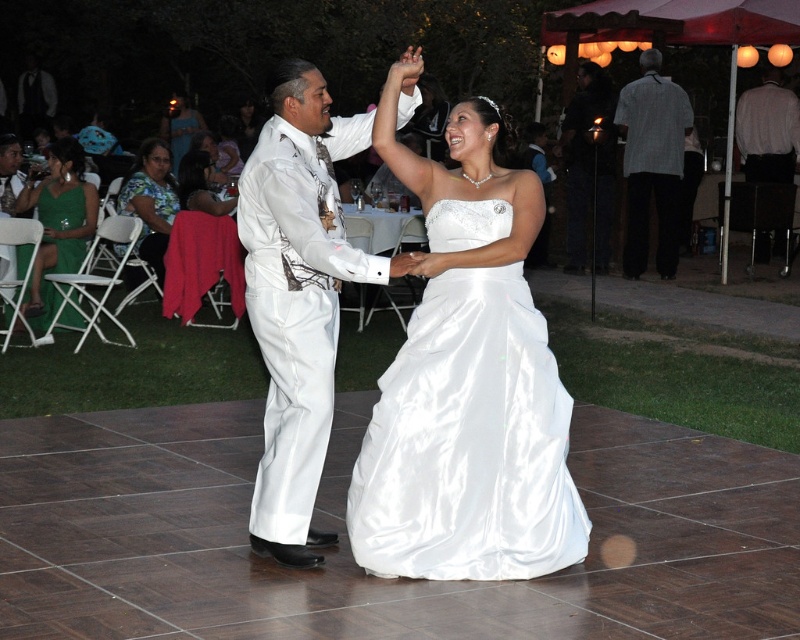
Question: From the image, what is the correct spatial relationship of gray striped shirt at upper right in relation to white satin shirt at right?

Choices:
 (A) left
 (B) right

Answer: (A)

Question: Among these objects, which one is nearest to the camera?

Choices:
 (A) green satin dress at lower left
 (B) green satin dress at left

Answer: (B)

Question: Which point is closer to the camera?

Choices:
 (A) (60, 228)
 (B) (544, 336)
 (C) (338, 134)

Answer: (B)

Question: Which object is the closest to the blue-green fabric dress at center-left?

Choices:
 (A) satin dress at center
 (B) matte black suit at right
 (C) green satin dress at left
 (D) matte black dress at upper center

Answer: (D)

Question: Where is gray striped shirt at upper right located in relation to green satin dress at left in the image?

Choices:
 (A) right
 (B) left

Answer: (A)

Question: Is gray striped shirt at upper right positioned behind matte black suit at right?

Choices:
 (A) yes
 (B) no

Answer: (B)